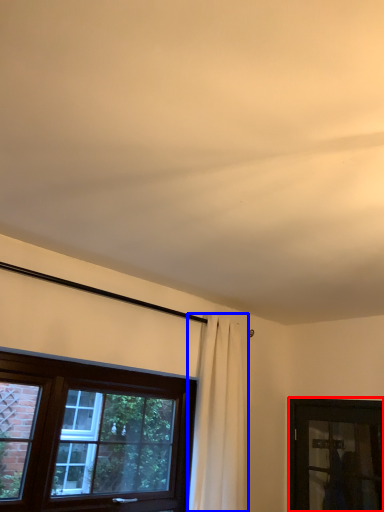
Question: Which point is closer to the camera, window (highlighted by a red box) or curtain (highlighted by a blue box)?

Choices:
 (A) window
 (B) curtain

Answer: (B)